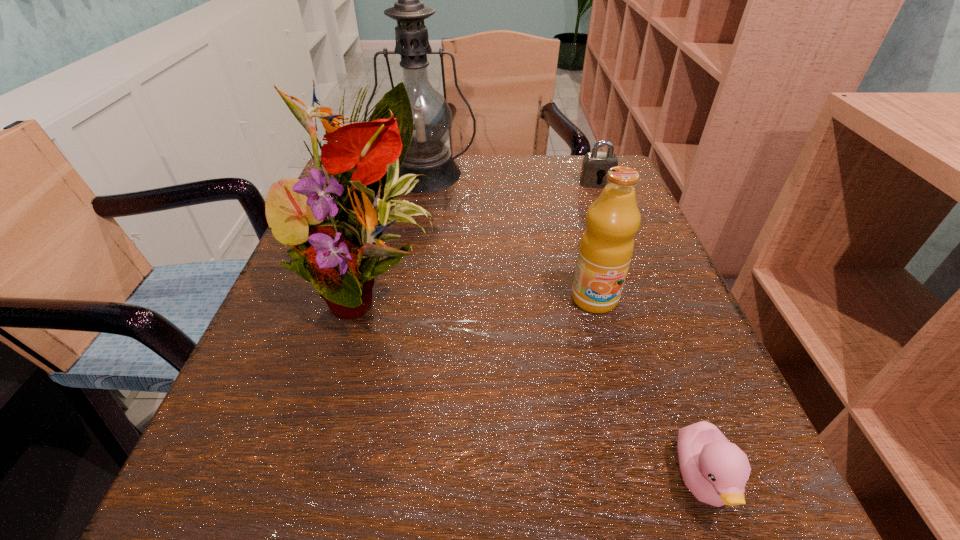
Find the location of a particular element. This screenshot has width=960, height=540. object that is at the near right corner is located at coordinates 715,470.

In the image, there is a desktop. Identify the location of vacant space at the far edge. click(x=462, y=187).

The image size is (960, 540). In the image, there is a desktop. Find the location of `blank space at the near edge`. blank space at the near edge is located at coordinates (548, 476).

In the image, there is a desktop. Identify the location of free space at the left edge. Image resolution: width=960 pixels, height=540 pixels. (285, 339).

In order to click on free space at the right edge of the desktop in this screenshot , I will do `click(674, 291)`.

Locate an element on the screen. vacant space at the near left corner of the desktop is located at coordinates (252, 530).

In the image, there is a desktop. Where is `vacant region at the near right corner`? Image resolution: width=960 pixels, height=540 pixels. vacant region at the near right corner is located at coordinates (665, 480).

Find the location of a particular element. vacant point located between the fruit juice and the nearest object is located at coordinates (649, 389).

You are a GUI agent. You are given a task and a screenshot of the screen. Output one action in this format:
    pyautogui.click(x=<x>, y=<y>)
    Task: Click on the vacant space that is in between the padlock and the bouquet
    
    Given the screenshot: What is the action you would take?
    pyautogui.click(x=484, y=236)

Image resolution: width=960 pixels, height=540 pixels. In order to click on vacant space that's between the oil lamp and the shortest object in this screenshot , I will do `click(564, 327)`.